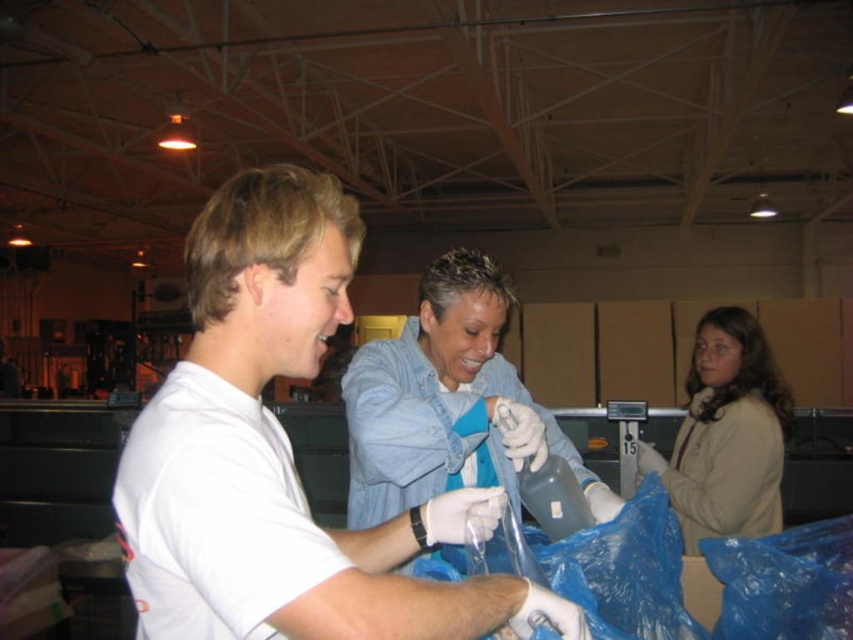
Question: Is white matte shirt at center bigger than beige fleece jacket at right?

Choices:
 (A) yes
 (B) no

Answer: (B)

Question: Estimate the real-world distances between objects in this image. Which object is closer to the white matte gloves at center?

Choices:
 (A) white matte shirt at center
 (B) beige fleece jacket at right

Answer: (A)

Question: Which of the following is the closest to the observer?

Choices:
 (A) white matte shirt at center
 (B) beige fleece jacket at right
 (C) white matte gloves at center

Answer: (A)

Question: Does white matte gloves at center appear over beige fleece jacket at right?

Choices:
 (A) no
 (B) yes

Answer: (B)

Question: Which point is farther to the camera?

Choices:
 (A) beige fleece jacket at right
 (B) white matte gloves at center

Answer: (A)

Question: Is the position of white matte gloves at center less distant than that of beige fleece jacket at right?

Choices:
 (A) yes
 (B) no

Answer: (A)